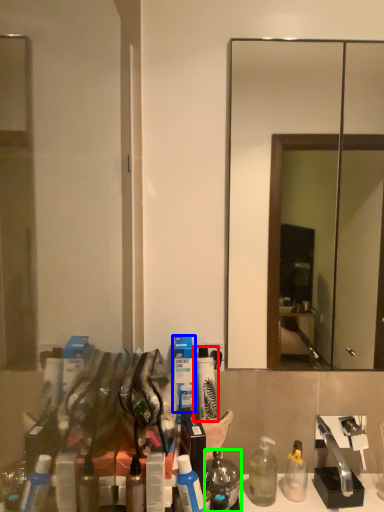
Question: Based on their relative distances, which object is farther from toiletry (highlighted by a red box)? Choose from toiletry (highlighted by a blue box) and mouthwash (highlighted by a green box).

Choices:
 (A) toiletry
 (B) mouthwash

Answer: (B)